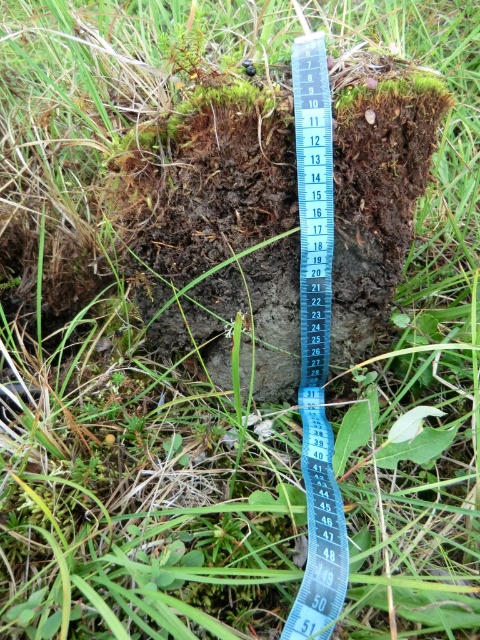
Question: Can you confirm if brown soil at center is thinner than blue plastic tape measure at center?

Choices:
 (A) no
 (B) yes

Answer: (A)

Question: Does brown soil at center lie in front of blue plastic tape measure at center?

Choices:
 (A) yes
 (B) no

Answer: (B)

Question: Which of the following is the farthest from the observer?

Choices:
 (A) (309, 388)
 (B) (286, 106)

Answer: (A)

Question: Is brown soil at center closer to the viewer compared to blue plastic tape measure at center?

Choices:
 (A) yes
 (B) no

Answer: (B)

Question: Which of the following is the closest to the observer?

Choices:
 (A) (264, 362)
 (B) (335, 499)

Answer: (B)